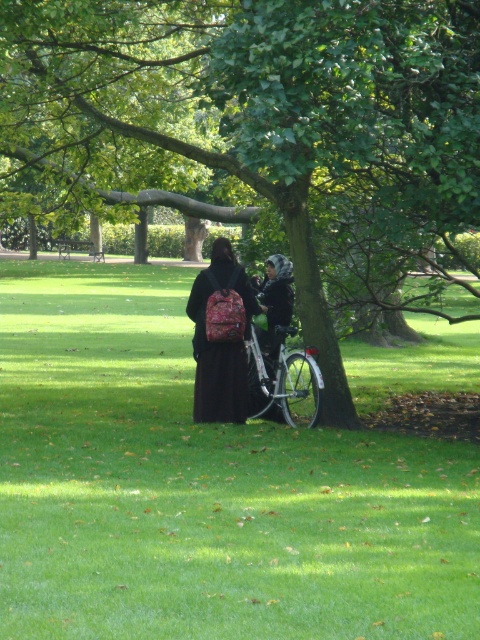
Question: Which point is farther to the camera?

Choices:
 (A) pyautogui.click(x=284, y=376)
 (B) pyautogui.click(x=19, y=490)
 (C) pyautogui.click(x=211, y=321)

Answer: (A)

Question: Can you confirm if green leafy tree at center is positioned below matte pink backpack at center?

Choices:
 (A) yes
 (B) no

Answer: (B)

Question: Is green leafy tree at center to the right of matte pink backpack at center from the viewer's perspective?

Choices:
 (A) no
 (B) yes

Answer: (A)

Question: Is green grass at center above matte pink backpack at center?

Choices:
 (A) no
 (B) yes

Answer: (A)

Question: Among these objects, which one is nearest to the camera?

Choices:
 (A) silver metallic bicycle at center
 (B) matte pink backpack at center
 (C) green grass at center

Answer: (C)

Question: Among these objects, which one is nearest to the camera?

Choices:
 (A) silver metallic bicycle at center
 (B) green grass at center

Answer: (B)